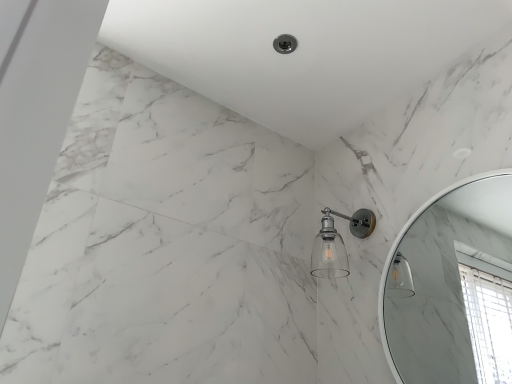
In order to face clear glass shower head at center, should I rotate leftwards or rightwards?

Rotate right and turn 11.480 degrees.

This screenshot has width=512, height=384. What do you see at coordinates (337, 242) in the screenshot?
I see `clear glass shower head at center` at bounding box center [337, 242].

At what (x,y) coordinates should I click in order to perform the action: click on clear glass shower head at center. Please return your answer as a coordinate pair (x, y). The height and width of the screenshot is (384, 512). Looking at the image, I should click on (337, 242).

What do you see at coordinates (453, 288) in the screenshot? I see `white glossy mirror at upper right` at bounding box center [453, 288].

You are a GUI agent. You are given a task and a screenshot of the screen. Output one action in this format:
    pyautogui.click(x=<x>, y=<y>)
    Task: Click on the white glossy mirror at upper right
    The height and width of the screenshot is (384, 512).
    Given the screenshot: What is the action you would take?
    pyautogui.click(x=453, y=288)

Locate an element on the screen. The width and height of the screenshot is (512, 384). clear glass shower head at center is located at coordinates pos(337,242).

Which object is positioned more to the left, clear glass shower head at center or white glossy mirror at upper right?

Positioned to the left is clear glass shower head at center.

Does clear glass shower head at center lie behind white glossy mirror at upper right?

Yes, it is behind white glossy mirror at upper right.

Considering the points (361, 217) and (489, 181), which point is behind, point (361, 217) or point (489, 181)?

The point (489, 181) is farther.

From the image's perspective, between clear glass shower head at center and white glossy mirror at upper right, which one is located above?

clear glass shower head at center appears higher in the image.

From a real-world perspective, does clear glass shower head at center stand above white glossy mirror at upper right?

Yes, from a real-world perspective, clear glass shower head at center is over white glossy mirror at upper right

Can you confirm if clear glass shower head at center is wider than white glossy mirror at upper right?

Yes.

Considering the sizes of clear glass shower head at center and white glossy mirror at upper right in the image, is clear glass shower head at center taller or shorter than white glossy mirror at upper right?

Considering their sizes, clear glass shower head at center has less height than white glossy mirror at upper right.

Considering the sizes of objects clear glass shower head at center and white glossy mirror at upper right in the image provided, who is smaller, clear glass shower head at center or white glossy mirror at upper right?

Smaller between the two is clear glass shower head at center.

Is clear glass shower head at center not inside white glossy mirror at upper right?

Yes, clear glass shower head at center is located beyond the bounds of white glossy mirror at upper right.

Is clear glass shower head at center not near white glossy mirror at upper right?

clear glass shower head at center is actually quite close to white glossy mirror at upper right.

Is clear glass shower head at center positioned with its back to white glossy mirror at upper right?

That's not correct — clear glass shower head at center is not looking away from white glossy mirror at upper right.

What's the angular difference between clear glass shower head at center and white glossy mirror at upper right's facing directions?

clear glass shower head at center and white glossy mirror at upper right are facing 1.65 degrees away from each other.

Find the location of `shower above the white glossy mirror at upper right (from the image's perspective)`. shower above the white glossy mirror at upper right (from the image's perspective) is located at coordinates (337, 242).

Is white glossy mirror at upper right to the left of clear glass shower head at center from the viewer's perspective?

No, white glossy mirror at upper right is not to the left of clear glass shower head at center.

Who is more distant, white glossy mirror at upper right or clear glass shower head at center?

Positioned behind is clear glass shower head at center.

Which is behind, point (509, 220) or point (331, 237)?

The point (509, 220) is farther.

From the image's perspective, between white glossy mirror at upper right and clear glass shower head at center, which one is located above?

clear glass shower head at center is shown above in the image.

From a real-world perspective, is white glossy mirror at upper right positioned above or below clear glass shower head at center?

white glossy mirror at upper right is below clear glass shower head at center.

Between white glossy mirror at upper right and clear glass shower head at center, which one has smaller width?

white glossy mirror at upper right is thinner.

Considering the sizes of white glossy mirror at upper right and clear glass shower head at center in the image, is white glossy mirror at upper right taller or shorter than clear glass shower head at center?

Clearly, white glossy mirror at upper right is taller compared to clear glass shower head at center.

Looking at this image, considering the relative sizes of white glossy mirror at upper right and clear glass shower head at center in the image provided, is white glossy mirror at upper right smaller than clear glass shower head at center?

No, white glossy mirror at upper right is not smaller than clear glass shower head at center.

Is white glossy mirror at upper right surrounding clear glass shower head at center?

No, clear glass shower head at center is not surrounded by white glossy mirror at upper right.

Can you see white glossy mirror at upper right touching clear glass shower head at center?

No, white glossy mirror at upper right is not touching clear glass shower head at center.

From the picture: Is white glossy mirror at upper right aimed at clear glass shower head at center?

No, white glossy mirror at upper right is not facing towards clear glass shower head at center.

I want to click on shower behind the white glossy mirror at upper right, so click(x=337, y=242).

This screenshot has width=512, height=384. Identify the location of shower above the white glossy mirror at upper right (from the image's perspective). (337, 242).

This screenshot has width=512, height=384. In order to click on mirror on the right of clear glass shower head at center in this screenshot , I will do `click(453, 288)`.